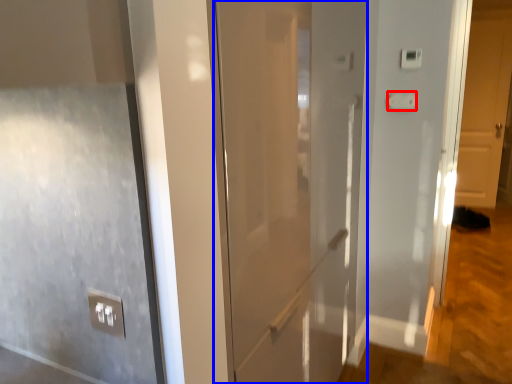
Question: Which object appears closest to the camera in this image, light switch (highlighted by a red box) or door (highlighted by a blue box)?

Choices:
 (A) light switch
 (B) door

Answer: (B)